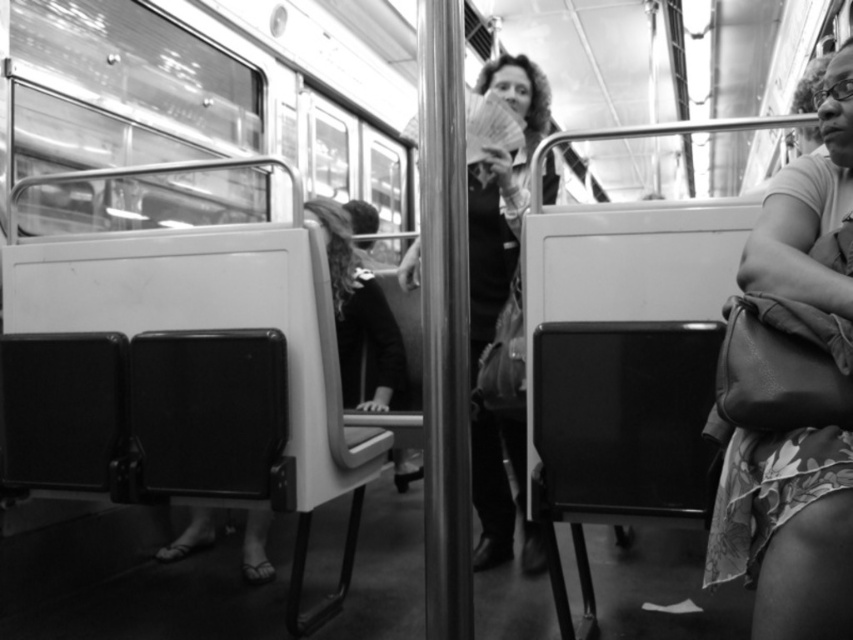
Question: Is leather handbag at right above matte black jacket at center?

Choices:
 (A) yes
 (B) no

Answer: (A)

Question: Which of the following is the farthest from the observer?

Choices:
 (A) leather handbag at right
 (B) matte black jacket at center

Answer: (B)

Question: Can you confirm if leather handbag at right is positioned to the left of matte black jacket at center?

Choices:
 (A) no
 (B) yes

Answer: (A)

Question: Is leather handbag at right positioned before matte black jacket at center?

Choices:
 (A) yes
 (B) no

Answer: (A)

Question: Among these objects, which one is nearest to the camera?

Choices:
 (A) leather handbag at right
 (B) matte black jacket at center

Answer: (A)